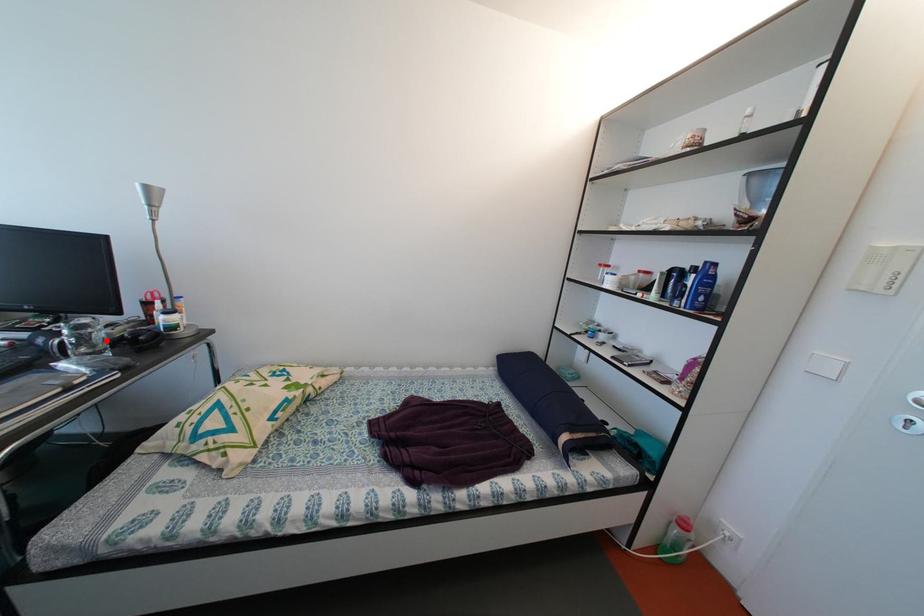
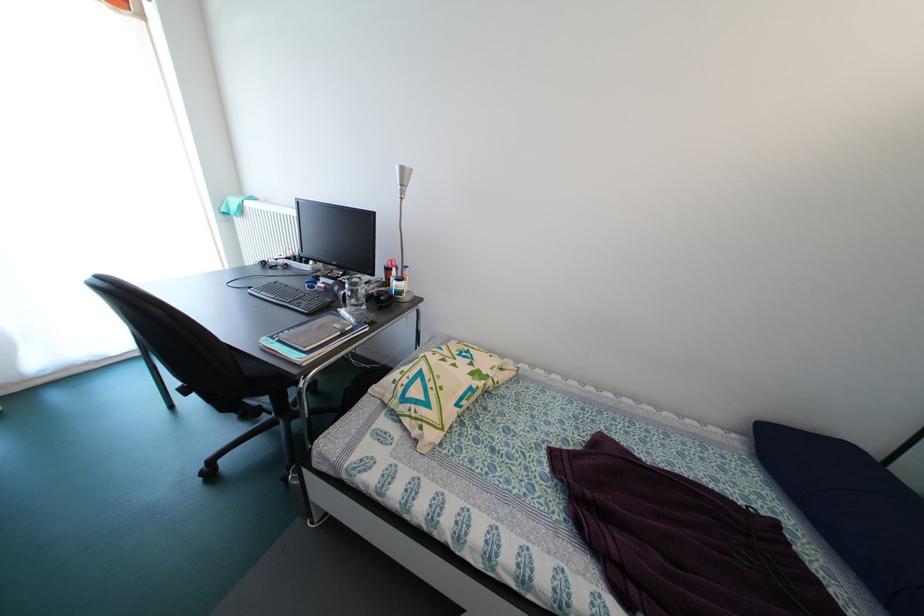
Find the pixel in the second image that matches the highlighted location in the first image.

(369, 297)